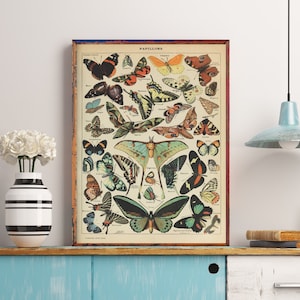
Find the location of a particular element. This screenshot has height=300, width=300. picture shadow is located at coordinates point(65,118).